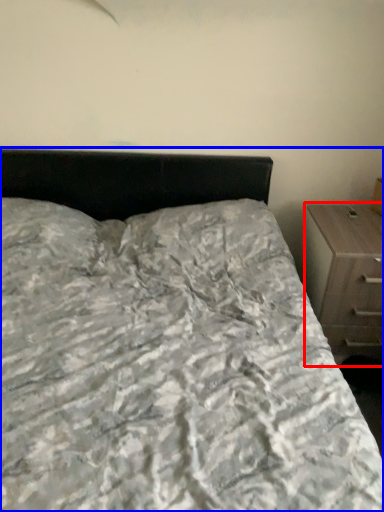
Question: Which object is closer to the camera taking this photo, chest of drawers (highlighted by a red box) or bed (highlighted by a blue box)?

Choices:
 (A) chest of drawers
 (B) bed

Answer: (B)